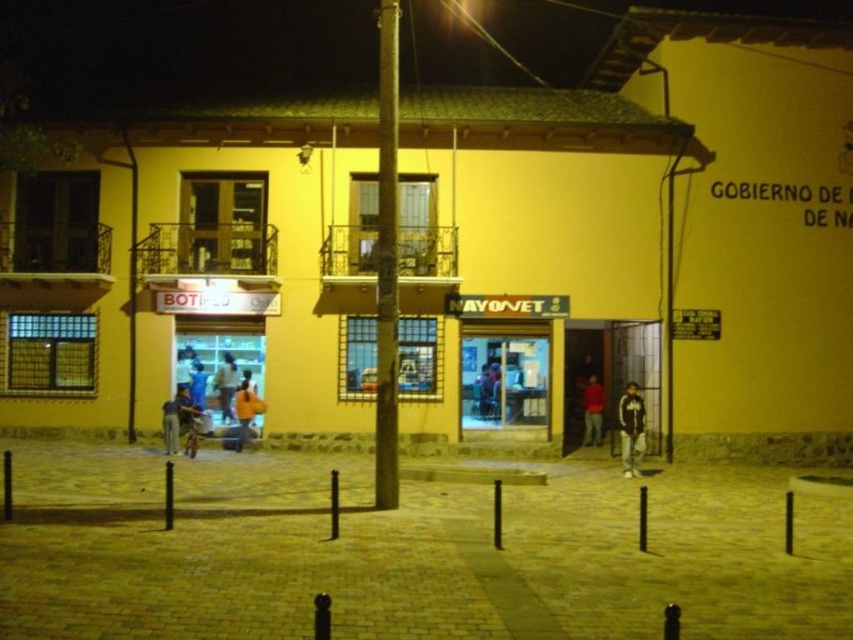
Consider the image. You are a photographer trying to capture both the red matte shirt at center and the orange fabric shirt at center in a single frame. Since you want both shirts to be clearly visible, which one should you focus on first to ensure the larger one is in sharp focus?

The red matte shirt at center is bigger than the orange fabric shirt at center, so you should focus on the red matte shirt at center first to ensure it is in sharp focus.

You are a delivery person who needs to place an orange fabric bag at center and an orange fabric shirt at center into a storage box. The box can only hold one of them. Which item should you choose based on their sizes?

The orange fabric bag at center is larger in size than orange fabric shirt at center, so you should choose the orange fabric shirt at center to fit into the storage box.

You are standing at the entrance of the shop in front of the building. You see two points marked on the ground. The first point is at coordinate point (575,108) and the second is at point (589,403). If you want to walk towards the point that is behind the other, which coordinate should you head to?

You should head to point (589,403) because it is behind point (575,108) according to the spatial arrangement.